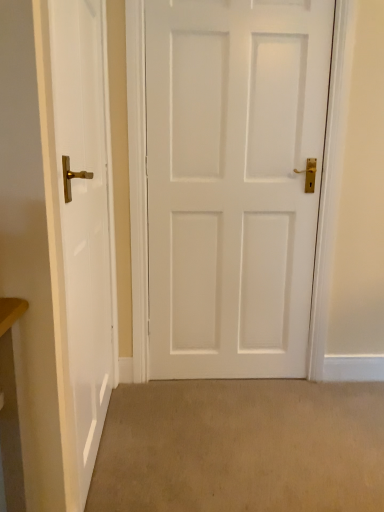
The image size is (384, 512). Find the location of `free area in between white glossy door at left, which appears as the 1th door when viewed from the left, and white matte door at center, placed as the 1th door when sorted from right to left`. free area in between white glossy door at left, which appears as the 1th door when viewed from the left, and white matte door at center, placed as the 1th door when sorted from right to left is located at coordinates (195, 423).